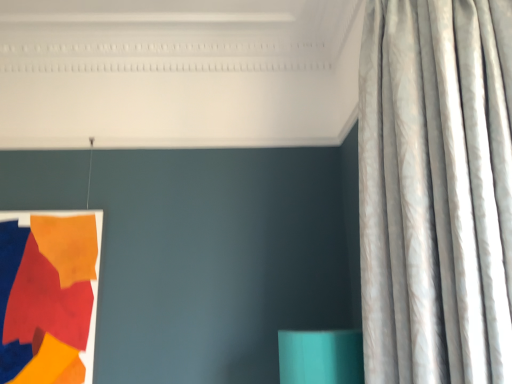
Question: Can matte fabric tapestry at left be found inside silvery textured curtain at right?

Choices:
 (A) no
 (B) yes

Answer: (A)

Question: Can you confirm if silvery textured curtain at right is taller than matte fabric tapestry at left?

Choices:
 (A) no
 (B) yes

Answer: (B)

Question: Is silvery textured curtain at right looking in the opposite direction of matte fabric tapestry at left?

Choices:
 (A) yes
 (B) no

Answer: (B)

Question: Is silvery textured curtain at right facing towards matte fabric tapestry at left?

Choices:
 (A) yes
 (B) no

Answer: (B)

Question: Would you consider silvery textured curtain at right to be distant from matte fabric tapestry at left?

Choices:
 (A) no
 (B) yes

Answer: (B)

Question: Is silvery textured curtain at right not within matte fabric tapestry at left?

Choices:
 (A) yes
 (B) no

Answer: (A)

Question: Is the depth of matte fabric tapestry at left greater than that of silvery textured curtain at right?

Choices:
 (A) yes
 (B) no

Answer: (A)

Question: Is matte fabric tapestry at left in front of silvery textured curtain at right?

Choices:
 (A) no
 (B) yes

Answer: (A)

Question: Are matte fabric tapestry at left and silvery textured curtain at right located far from each other?

Choices:
 (A) no
 (B) yes

Answer: (B)

Question: Considering the relative sizes of matte fabric tapestry at left and silvery textured curtain at right in the image provided, is matte fabric tapestry at left shorter than silvery textured curtain at right?

Choices:
 (A) no
 (B) yes

Answer: (B)

Question: From a real-world perspective, is matte fabric tapestry at left on top of silvery textured curtain at right?

Choices:
 (A) no
 (B) yes

Answer: (A)

Question: Is matte fabric tapestry at left aimed at silvery textured curtain at right?

Choices:
 (A) yes
 (B) no

Answer: (B)

Question: From the image's perspective, is matte fabric tapestry at left above or below silvery textured curtain at right?

Choices:
 (A) above
 (B) below

Answer: (B)